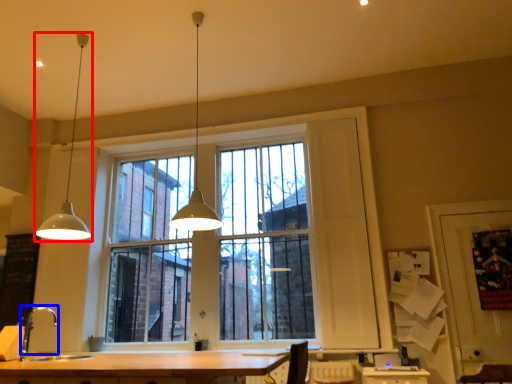
Question: Which of the following is the closest to the observer, lamp (highlighted by a red box) or faucet (highlighted by a blue box)?

Choices:
 (A) lamp
 (B) faucet

Answer: (B)